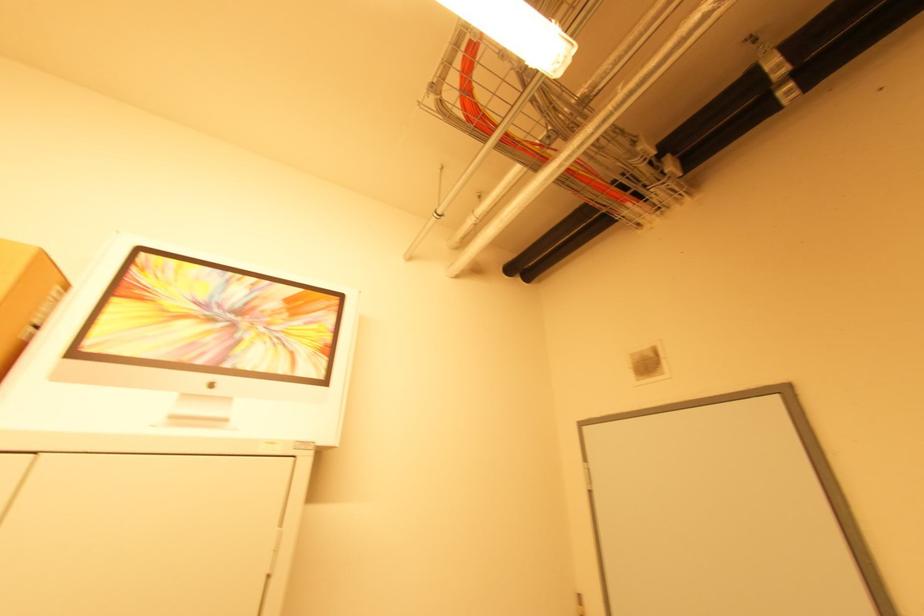
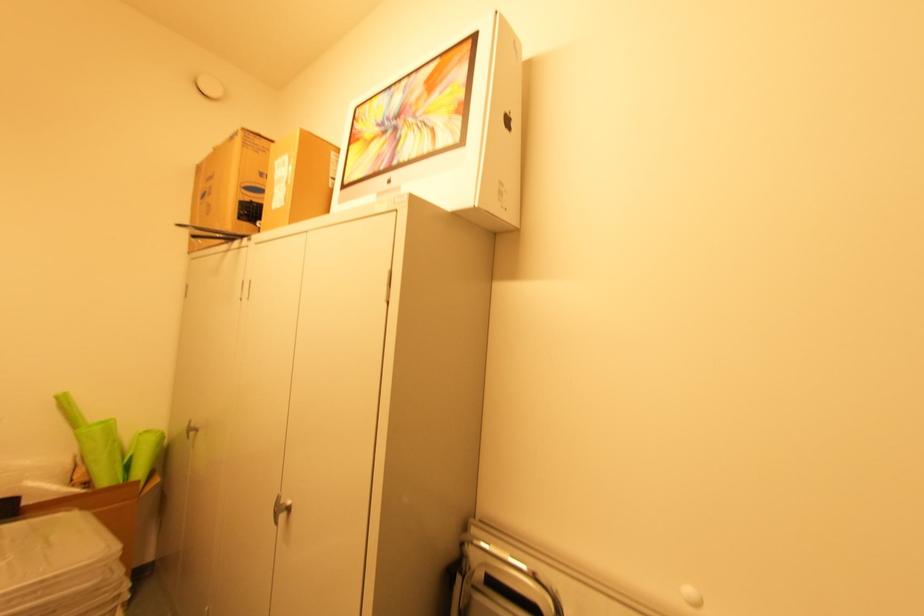
Where in the second image is the point corresponding to point 32,329 from the first image?

(334, 180)